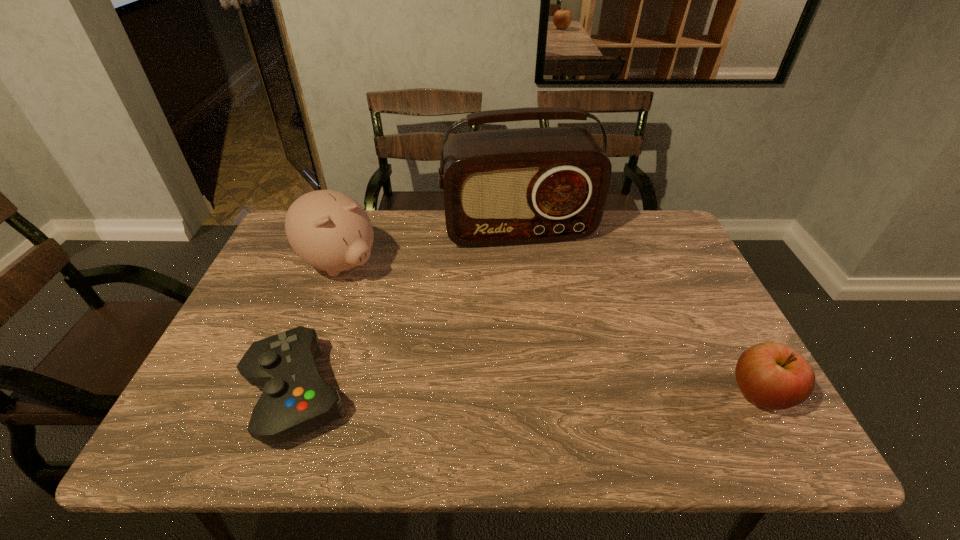
Where is `free space located 0.370m at the snout of the third shortest object`? Image resolution: width=960 pixels, height=540 pixels. free space located 0.370m at the snout of the third shortest object is located at coordinates (460, 356).

This screenshot has height=540, width=960. I want to click on free space located 0.330m on the front panel of the second object from right to left, so click(x=556, y=334).

Find the location of a particular element. free space located 0.060m on the front panel of the second object from right to left is located at coordinates (534, 264).

Where is `blank area located on the front panel of the second object from right to left`? This screenshot has width=960, height=540. blank area located on the front panel of the second object from right to left is located at coordinates (559, 344).

Image resolution: width=960 pixels, height=540 pixels. Identify the location of piggy bank present at the far edge. (330, 231).

Locate an element on the screen. This screenshot has width=960, height=540. radio receiver positioned at the far edge is located at coordinates (501, 187).

Find the location of a particular element. The height and width of the screenshot is (540, 960). control that is at the near edge is located at coordinates (296, 400).

Locate an element on the screen. apple located in the near edge section of the desktop is located at coordinates (772, 375).

Find the location of a particular element. The image size is (960, 540). control that is at the left edge is located at coordinates (296, 400).

Where is `piggy bank that is positioned at the left edge`? This screenshot has height=540, width=960. piggy bank that is positioned at the left edge is located at coordinates (330, 231).